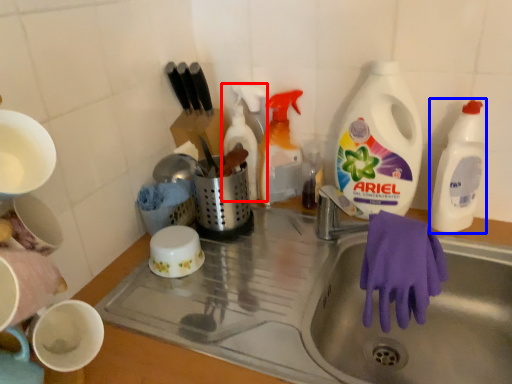
Question: Which of the following is the closest to the observer, cleaning product (highlighted by a red box) or cleaning product (highlighted by a blue box)?

Choices:
 (A) cleaning product
 (B) cleaning product

Answer: (B)